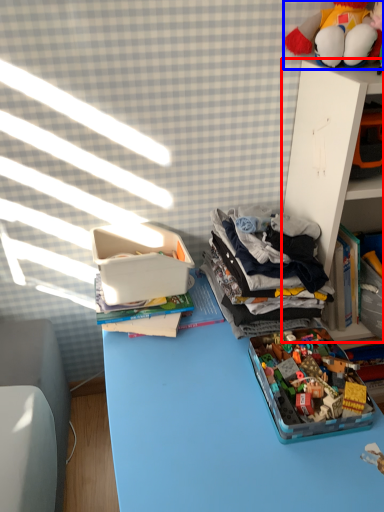
Question: Which object appears farthest to the camera in this image, shelf (highlighted by a red box) or toy (highlighted by a blue box)?

Choices:
 (A) shelf
 (B) toy

Answer: (A)